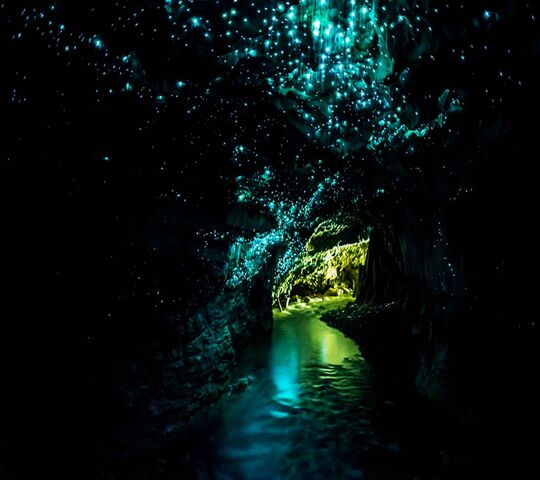
Identify the location of neon green on wall. (364, 245), (330, 256), (317, 272).